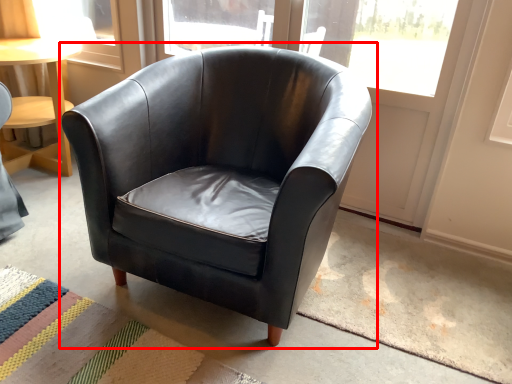
Question: From the image's perspective, where is chair (annotated by the red box) located in relation to mat in the image?

Choices:
 (A) above
 (B) below

Answer: (A)